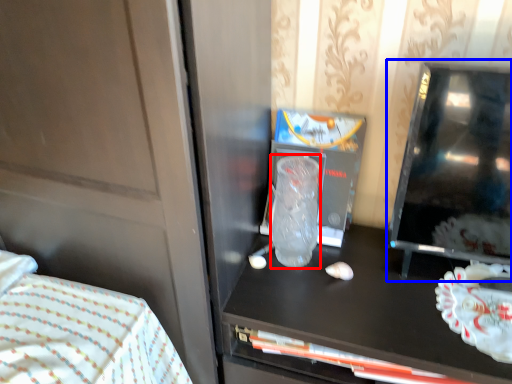
Question: Among these objects, which one is nearest to the camera, glass vase (highlighted by a red box) or appliance (highlighted by a blue box)?

Choices:
 (A) glass vase
 (B) appliance

Answer: (B)